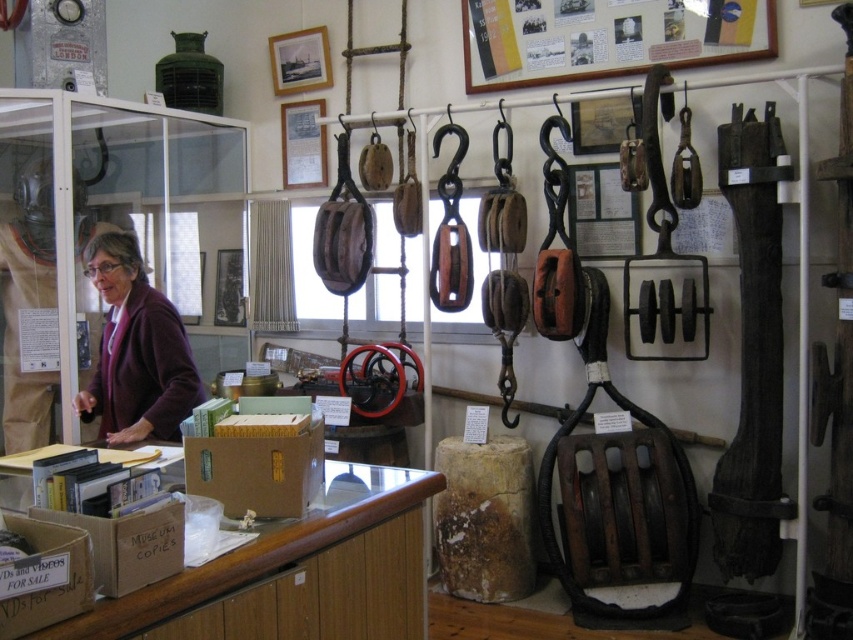
Who is taller, wooden frame at upper center or matte purple sweater at left?

matte purple sweater at left is taller.

Does wooden frame at upper center appear on the left side of matte purple sweater at left?

Incorrect, wooden frame at upper center is not on the left side of matte purple sweater at left.

Does point (462, 26) come in front of point (158, 292)?

No, it is behind (158, 292).

Locate an element on the screen. The width and height of the screenshot is (853, 640). wooden frame at upper center is located at coordinates (612, 36).